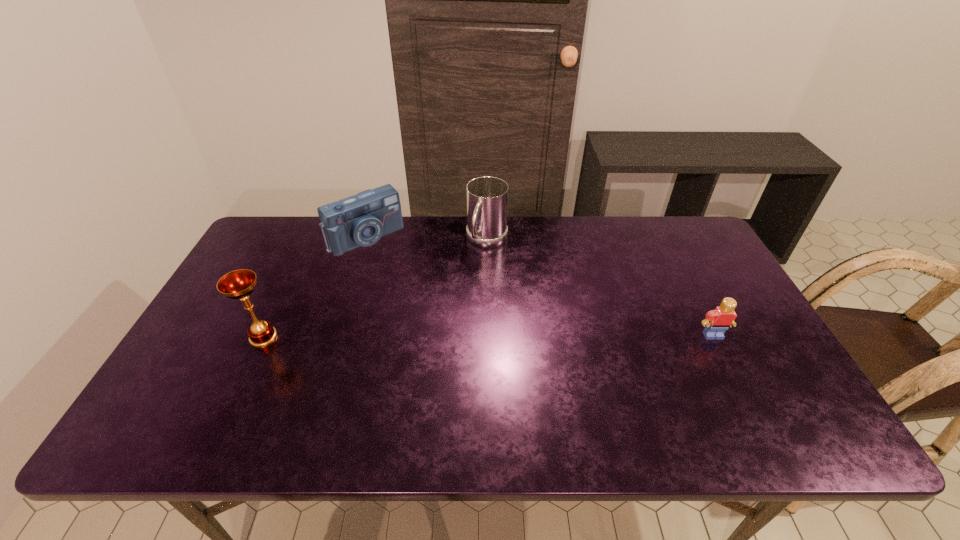
Where is `free spot on the desktop that is between the leftmost object and the shortest object and is positioned on the lens of the third object from right to left`? This screenshot has width=960, height=540. free spot on the desktop that is between the leftmost object and the shortest object and is positioned on the lens of the third object from right to left is located at coordinates (455, 336).

In order to click on free spot on the desktop that is between the leftmost object and the shortest object and is positioned on the side of the third object from left to right with the handle in this screenshot , I will do `click(431, 336)`.